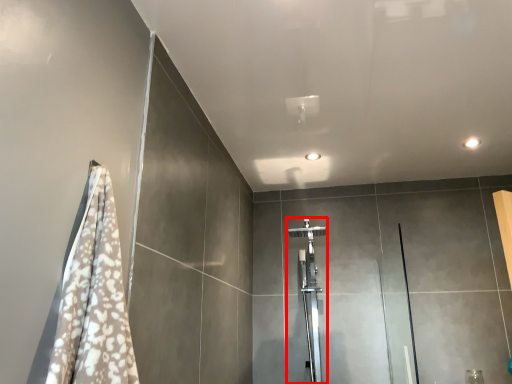
Question: From the image's perspective, where is shower (annotated by the red box) located in relation to screen door in the image?

Choices:
 (A) below
 (B) above

Answer: (B)